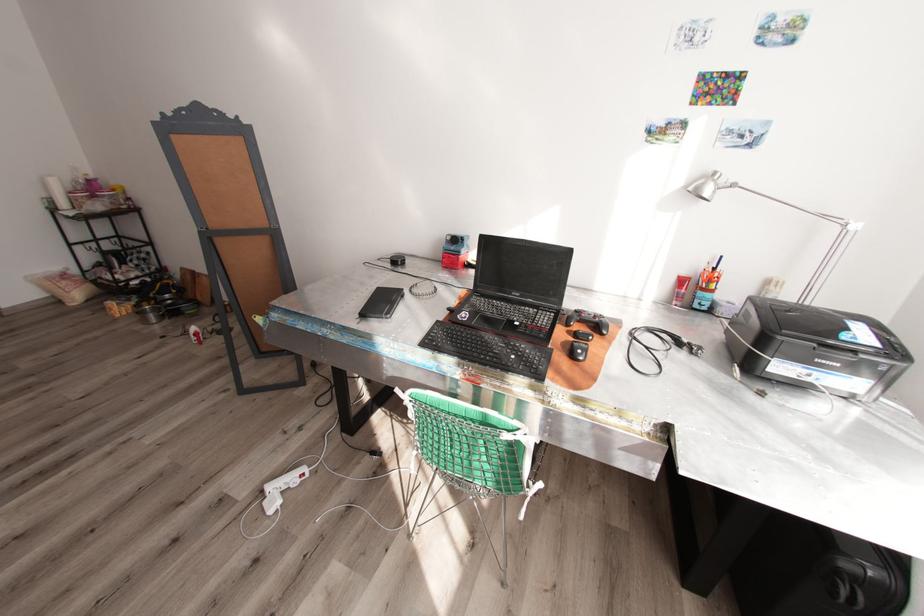
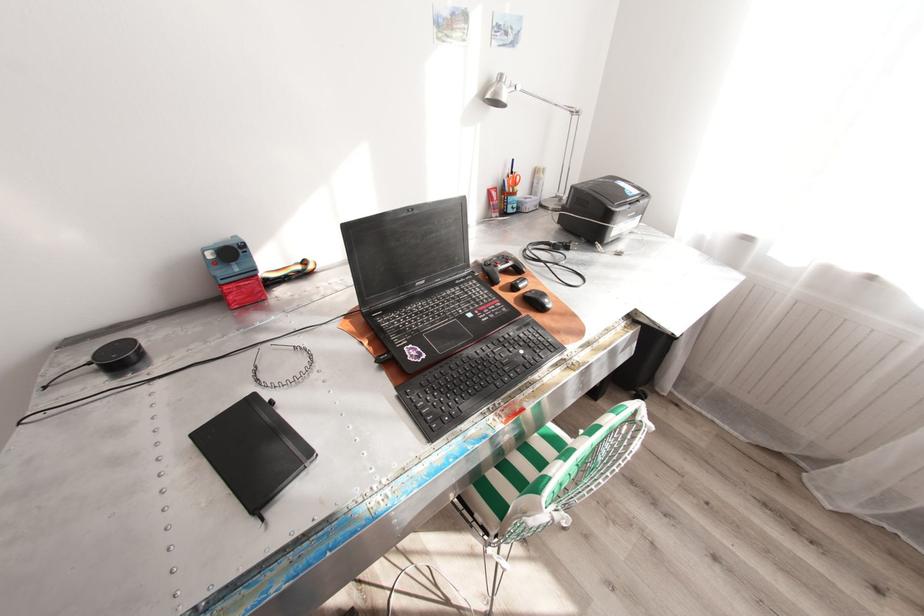
Find the pixel in the second image that matches (454,238) in the first image.

(215, 254)